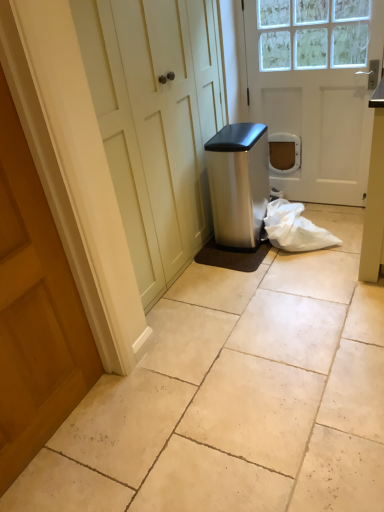
Where is `vacant area that is situated to the right of wooden door at left, arranged as the first door when viewed from the left`? This screenshot has width=384, height=512. vacant area that is situated to the right of wooden door at left, arranged as the first door when viewed from the left is located at coordinates (161, 419).